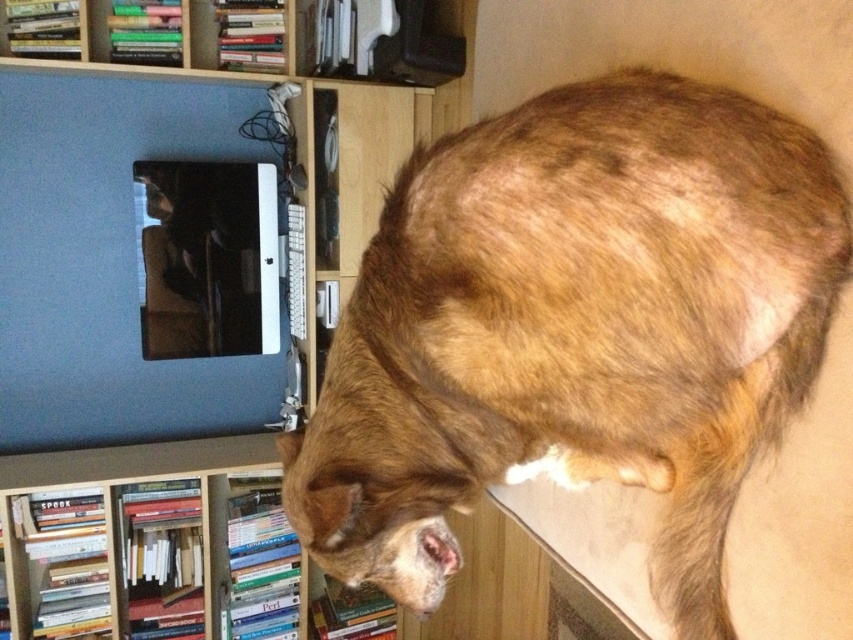
Can you confirm if brown fur at upper right is wider than wooden bookshelf at lower left?

Incorrect, brown fur at upper right's width does not surpass wooden bookshelf at lower left's.

Is brown fur at upper right closer to camera compared to wooden bookshelf at lower left?

Yes, it is.

Identify the location of brown fur at upper right. (573, 328).

From the picture: Measure the distance between brown fur at upper right and camera.

brown fur at upper right is 38.85 inches from camera.

Does point (772, 416) come behind point (460, 122)?

No, (772, 416) is in front of (460, 122).

Locate an element on the screen. brown fur at upper right is located at coordinates (573, 328).

Is point (33, 605) farther from viewer compared to point (422, 100)?

Yes, point (33, 605) is behind point (422, 100).

Is wooden bookshelf at lower left closer to the viewer compared to matte blue monitor at upper left?

No.

Is point (189, 499) behind point (447, 84)?

No.

Where is `wooden bookshelf at lower left`? The width and height of the screenshot is (853, 640). wooden bookshelf at lower left is located at coordinates (151, 541).